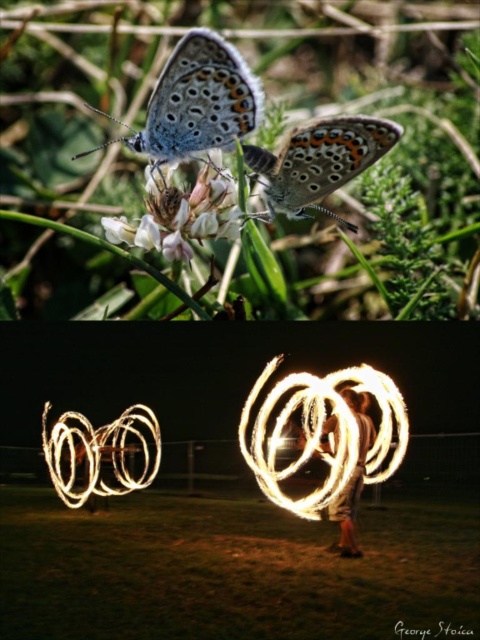
You are standing in the bottom section of the image and see the green grass at lower center and the shiny metallic blue butterfly at upper left. Which object is located to the right of the other?

The green grass at lower center is located to the right of the shiny metallic blue butterfly at upper left.

You are a gardener who wants to place a 30 inch long decorative fence between the green grass at lower center and the shiny metallic blue butterfly at upper left. Can you fit it without overlapping either object?

The distance between the green grass at lower center and the shiny metallic blue butterfly at upper left is 32.78 inches. Since the fence is 30 inches long, it can be placed between them without overlapping either object as there is enough space.

In the scene shown: You are standing in the bottom section of the image and see the green grass at lower center and the fire spinner at center. Which object is located to the left of the other?

The green grass at lower center is positioned on the left side of fire spinner at center.